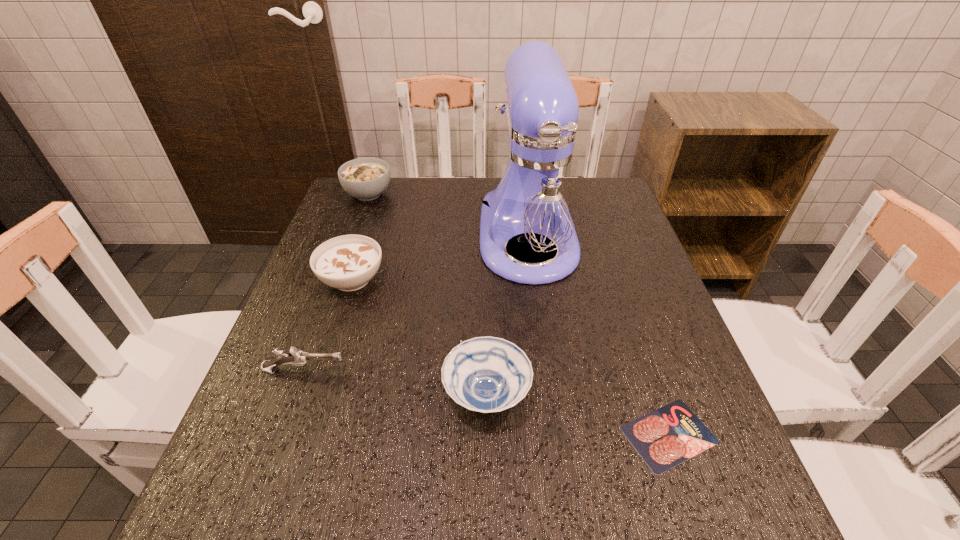
At what (x,y) coordinates should I click in order to perform the action: click on vacant region at the far edge. Please return your answer as a coordinate pair (x, y). Looking at the image, I should click on (466, 220).

The image size is (960, 540). Find the location of `blank space at the left edge of the desktop`. blank space at the left edge of the desktop is located at coordinates 340,344.

The width and height of the screenshot is (960, 540). In order to click on free location at the right edge of the desktop in this screenshot , I will do `click(672, 475)`.

The width and height of the screenshot is (960, 540). Find the location of `free space at the near right corner of the desktop`. free space at the near right corner of the desktop is located at coordinates (735, 534).

The width and height of the screenshot is (960, 540). What are the coordinates of `free spot between the second nearest soup bowl and the tallest object` in the screenshot? It's located at (440, 258).

Where is `unoccupied position between the tallest object and the gun`? unoccupied position between the tallest object and the gun is located at coordinates (417, 303).

Where is `unoccupied area between the mixer and the rightmost soup bowl`? The image size is (960, 540). unoccupied area between the mixer and the rightmost soup bowl is located at coordinates (507, 316).

The height and width of the screenshot is (540, 960). Identify the location of vacant space that's between the gun and the tallest object. (417, 303).

Find the location of a particular element. This screenshot has height=540, width=960. vacant area that lies between the tallest object and the gun is located at coordinates (417, 303).

Where is `free space between the shortest object and the second tallest object`? This screenshot has height=540, width=960. free space between the shortest object and the second tallest object is located at coordinates (518, 314).